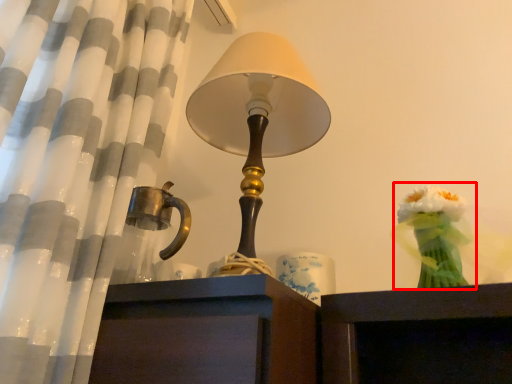
Question: Where is floral arrangement (annotated by the red box) located in relation to candle holder in the image?

Choices:
 (A) left
 (B) right

Answer: (B)